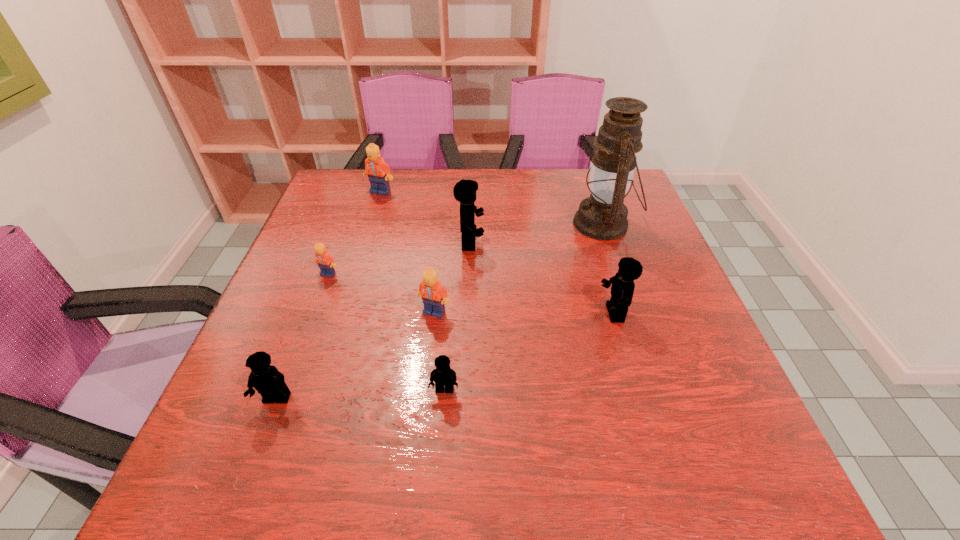
Where is `free region located 0.100m on the front-facing side of the leftmost yellow Lego`? The image size is (960, 540). free region located 0.100m on the front-facing side of the leftmost yellow Lego is located at coordinates tap(251, 467).

Image resolution: width=960 pixels, height=540 pixels. Identify the location of blank space located 0.100m on the front-facing side of the second farthest orange Lego. (315, 309).

Image resolution: width=960 pixels, height=540 pixels. In order to click on free location located 0.130m on the front-facing side of the smallest yellow Lego in this screenshot , I will do `click(439, 470)`.

Locate an element on the screen. oil lamp at the far edge is located at coordinates (603, 216).

The height and width of the screenshot is (540, 960). I want to click on Lego located at the far edge, so click(378, 171).

Find the location of a particular element. oil lamp present at the right edge is located at coordinates pyautogui.click(x=603, y=216).

Locate an element on the screen. This screenshot has height=540, width=960. Lego that is at the right edge is located at coordinates (622, 288).

Where is `object positioned at the far left corner`? The width and height of the screenshot is (960, 540). object positioned at the far left corner is located at coordinates (378, 171).

Locate an element on the screen. The width and height of the screenshot is (960, 540). object located at the far right corner is located at coordinates [603, 216].

Identify the location of vacant space at the far edge. The width and height of the screenshot is (960, 540). (528, 181).